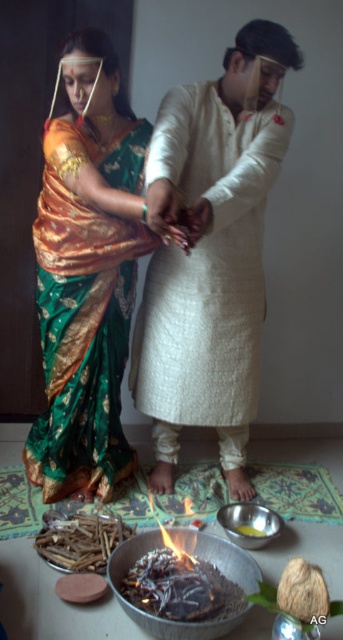
Does white textured kurta at center have a greater height compared to green silk saree at center?

Indeed, white textured kurta at center has a greater height compared to green silk saree at center.

Is white textured kurta at center wider than green silk saree at center?

Yes, white textured kurta at center is wider than green silk saree at center.

Who is more distant from viewer, (x=214, y=294) or (x=100, y=244)?

Positioned behind is point (x=214, y=294).

Identify the location of white textured kurta at center. (210, 252).

Between green silk saree at center and shiny silver bowl at center, which one has less height?

Standing shorter between the two is shiny silver bowl at center.

Which is behind, point (124, 154) or point (242, 532)?

Point (124, 154)

The image size is (343, 640). Find the location of `green silk saree at center`. green silk saree at center is located at coordinates (85, 314).

The image size is (343, 640). Find the location of `green silk saree at center`. green silk saree at center is located at coordinates (85, 314).

Can you confirm if white textured kurta at center is positioned to the left of shiny silver bowl at center?

Correct, you'll find white textured kurta at center to the left of shiny silver bowl at center.

Between white textured kurta at center and shiny silver bowl at center, which one is positioned lower?

shiny silver bowl at center

Who is more distant from viewer, (238, 154) or (262, 536)?

Point (238, 154)

Find the location of a particular element. This screenshot has height=640, width=343. white textured kurta at center is located at coordinates click(210, 252).